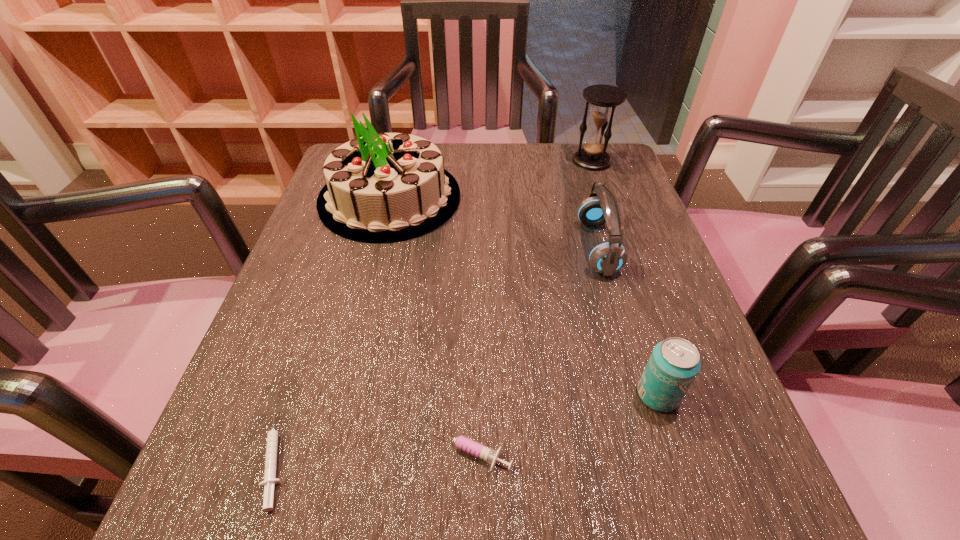
The width and height of the screenshot is (960, 540). In order to click on vacant region between the fourth shortest object and the tallest object in this screenshot , I will do `click(493, 222)`.

Choose which object is the fourth nearest neighbor to the hourglass. Please provide its 2D coordinates. Your answer should be formatted as a tuple, i.e. [(x, y)], where the tuple contains the x and y coordinates of a point satisfying the conditions above.

[(467, 445)]

Locate which object ranks fourth in proximity to the fourth tallest object. Please provide its 2D coordinates. Your answer should be formatted as a tuple, i.e. [(x, y)], where the tuple contains the x and y coordinates of a point satisfying the conditions above.

[(270, 480)]

The height and width of the screenshot is (540, 960). I want to click on free spot that satisfies the following two spatial constraints: 1. on the back side of the tallest object; 2. on the right side of the shorter syringe, so click(361, 198).